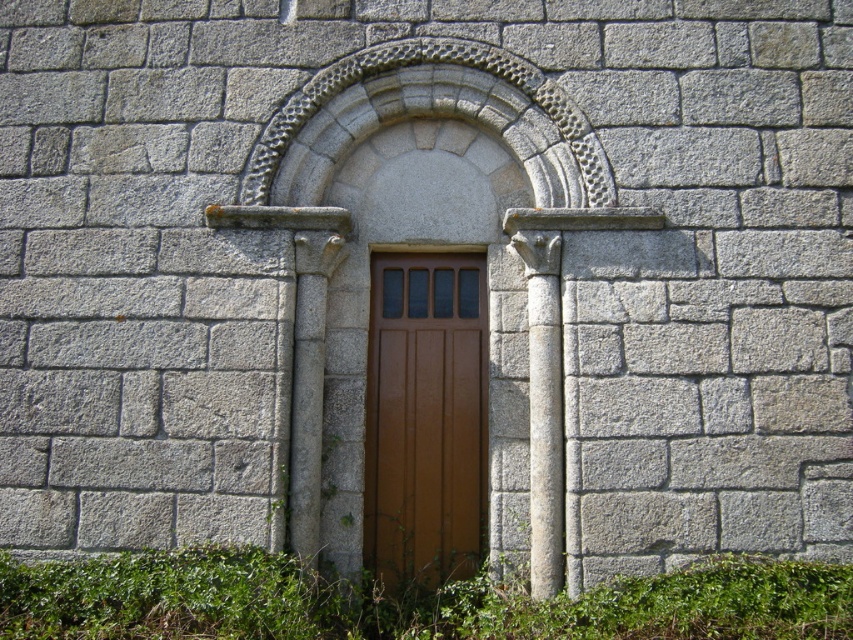
Does green leafy weed at lower center have a greater width compared to gray stone column at right?

Yes.

Locate an element on the screen. The image size is (853, 640). green leafy weed at lower center is located at coordinates (407, 602).

Where is `green leafy weed at lower center`? This screenshot has height=640, width=853. green leafy weed at lower center is located at coordinates (407, 602).

Between green leafy weed at lower center and brown wooden door at center, which one appears on the left side from the viewer's perspective?

Positioned to the left is green leafy weed at lower center.

This screenshot has height=640, width=853. In order to click on green leafy weed at lower center in this screenshot , I will do `click(407, 602)`.

Which is behind, point (462, 596) or point (387, 390)?

Point (387, 390)

Identify the location of green leafy weed at lower center. (407, 602).

Is brown wooden door at center wider than gray stone column at right?

Yes.

Who is positioned more to the left, brown wooden door at center or gray stone column at right?

Positioned to the left is brown wooden door at center.

Is point (369, 378) farther from camera compared to point (534, 502)?

Yes, it is behind point (534, 502).

At what (x,y) coordinates should I click in order to perform the action: click on brown wooden door at center. Please return your answer as a coordinate pair (x, y). This screenshot has height=640, width=853. Looking at the image, I should click on (425, 417).